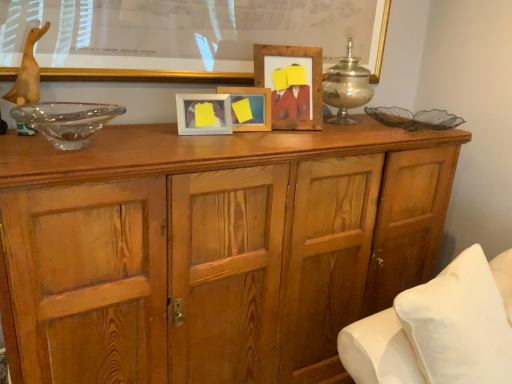
Question: In terms of height, does white soft pillow at lower right look taller or shorter compared to wooden photo frame at center, which is the second picture frame in right-to-left order?

Choices:
 (A) short
 (B) tall

Answer: (B)

Question: In the image, is white soft pillow at lower right on the left side or the right side of wooden photo frame at center, placed as the 2th picture frame when sorted from left to right?

Choices:
 (A) right
 (B) left

Answer: (A)

Question: Considering the real-world distances, which object is farthest from the transparent glass bowl at left?

Choices:
 (A) silver metallic candle holder at upper center
 (B) wooden photo frame at center, placed as the 2th picture frame when sorted from left to right
 (C) wooden picture frame at center, which ranks as the 1th picture frame in right-to-left order
 (D) wooden cabinet at center
 (E) matte wooden picture frame at center, the third picture frame positioned from the right

Answer: (A)

Question: Estimate the real-world distances between objects in this image. Which object is closer to the wooden frame at upper center?

Choices:
 (A) wooden picture frame at center, which ranks as the 1th picture frame in right-to-left order
 (B) matte wooden picture frame at center, the third picture frame positioned from the right
 (C) white soft pillow at lower right
 (D) silver metallic candle holder at upper center
 (E) wooden photo frame at center, placed as the 2th picture frame when sorted from left to right

Answer: (E)